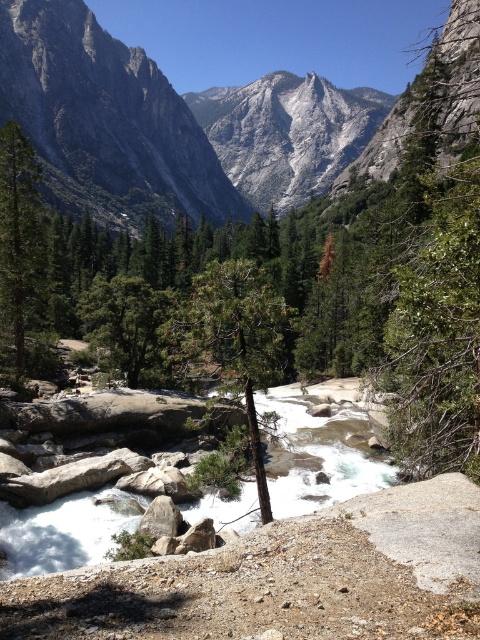
Question: Observing the image, what is the correct spatial positioning of gray granite mountain at upper center in reference to green matte tree at left?

Choices:
 (A) below
 (B) above

Answer: (B)

Question: Which of the following is the farthest from the observer?

Choices:
 (A) (192, 292)
 (B) (456, 252)
 (C) (22, 352)

Answer: (A)

Question: Which point is closer to the camera?

Choices:
 (A) (20, 260)
 (B) (29, 138)
 (C) (443, 317)
 (D) (206, 275)

Answer: (C)

Question: Is gray granite mountain at upper center smaller than green matte tree at left?

Choices:
 (A) no
 (B) yes

Answer: (A)

Question: Which of the following is the closest to the observer?

Choices:
 (A) (165, 90)
 (B) (261, 282)
 (C) (447, 104)

Answer: (B)

Question: Can you confirm if green leafy tree at upper center is bigger than green matte tree at left?

Choices:
 (A) yes
 (B) no

Answer: (A)